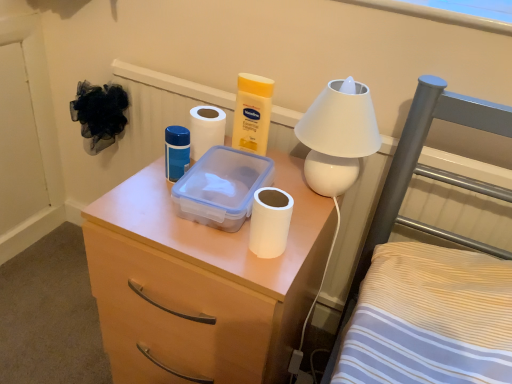
Question: Does white matte toilet paper at center, which is the 1th toilet paper in top-to-bottom order, come in front of transparent plastic storage box at center?

Choices:
 (A) yes
 (B) no

Answer: (B)

Question: Is white matte toilet paper at center, arranged as the 1th toilet paper when viewed from the back, located outside transparent plastic storage box at center?

Choices:
 (A) no
 (B) yes

Answer: (B)

Question: Is the position of white matte toilet paper at center, arranged as the 1th toilet paper when viewed from the back, more distant than that of transparent plastic storage box at center?

Choices:
 (A) no
 (B) yes

Answer: (B)

Question: Is white matte toilet paper at center, which is the 1th toilet paper in top-to-bottom order, directly adjacent to transparent plastic storage box at center?

Choices:
 (A) yes
 (B) no

Answer: (B)

Question: Is white matte toilet paper at center, which appears as the 2th toilet paper when viewed from the front, turned away from transparent plastic storage box at center?

Choices:
 (A) no
 (B) yes

Answer: (A)

Question: Is transparent plastic storage box at center taller or shorter than blue matte container at center?

Choices:
 (A) short
 (B) tall

Answer: (A)

Question: Which is correct: transparent plastic storage box at center is inside blue matte container at center, or outside of it?

Choices:
 (A) outside
 (B) inside

Answer: (A)

Question: From the image's perspective, is transparent plastic storage box at center positioned above or below blue matte container at center?

Choices:
 (A) below
 (B) above

Answer: (A)

Question: Considering their positions, is transparent plastic storage box at center located in front of or behind blue matte container at center?

Choices:
 (A) behind
 (B) front

Answer: (B)

Question: Based on their sizes in the image, would you say white matte plastic at center is bigger or smaller than white glossy lamp at upper right?

Choices:
 (A) big
 (B) small

Answer: (A)

Question: Is white matte plastic at center to the left or to the right of white glossy lamp at upper right in the image?

Choices:
 (A) right
 (B) left

Answer: (B)

Question: Looking at their shapes, would you say white matte plastic at center is wider or thinner than white glossy lamp at upper right?

Choices:
 (A) thin
 (B) wide

Answer: (B)

Question: In terms of height, does white matte plastic at center look taller or shorter compared to white glossy lamp at upper right?

Choices:
 (A) tall
 (B) short

Answer: (A)

Question: Looking at the image, does white matte plastic at center seem bigger or smaller compared to transparent plastic storage box at center?

Choices:
 (A) big
 (B) small

Answer: (A)

Question: Is point (165, 334) closer or farther from the camera than point (195, 200)?

Choices:
 (A) closer
 (B) farther

Answer: (B)